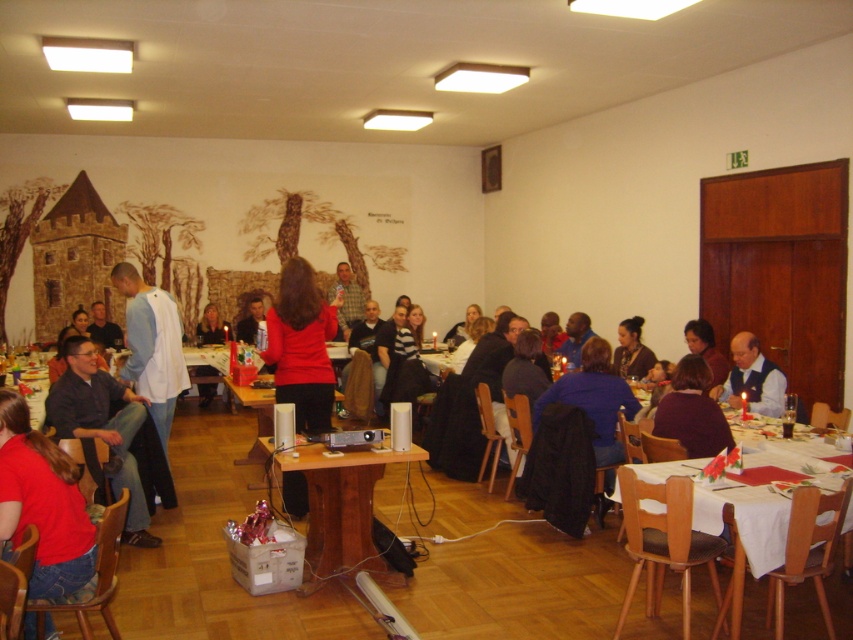
Question: Can you confirm if dark blue shirt at lower left is positioned to the left of dark blue sweater at center?

Choices:
 (A) yes
 (B) no

Answer: (A)

Question: Which point is farther to the camera?

Choices:
 (A) light blue shirt at center
 (B) matte blue vest at lower right
 (C) wooden table at lower left

Answer: (A)

Question: Considering the relative positions of dark blue shirt at lower left and dark brown hair at center in the image provided, where is dark blue shirt at lower left located with respect to dark brown hair at center?

Choices:
 (A) right
 (B) left

Answer: (B)

Question: Based on their relative distances, which object is farther from the dark brown hair at center?

Choices:
 (A) matte red sweater at center
 (B) red matte shirt at center
 (C) light blue shirt at center

Answer: (C)

Question: From the image, what is the correct spatial relationship of wooden table at center in relation to dark blue sweater at center?

Choices:
 (A) below
 (B) above

Answer: (A)

Question: Which point is farther to the camera?

Choices:
 (A) (370, 548)
 (B) (323, 422)

Answer: (B)